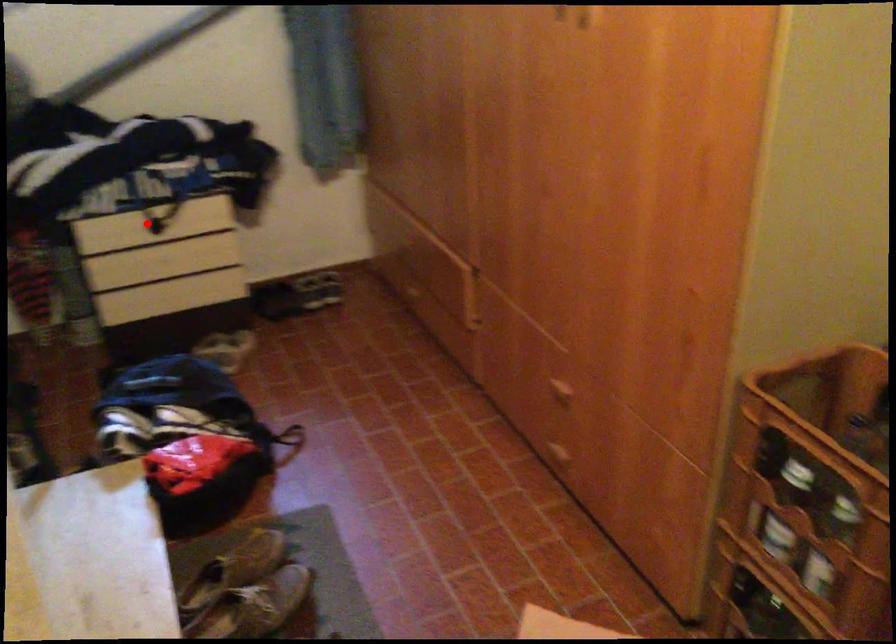
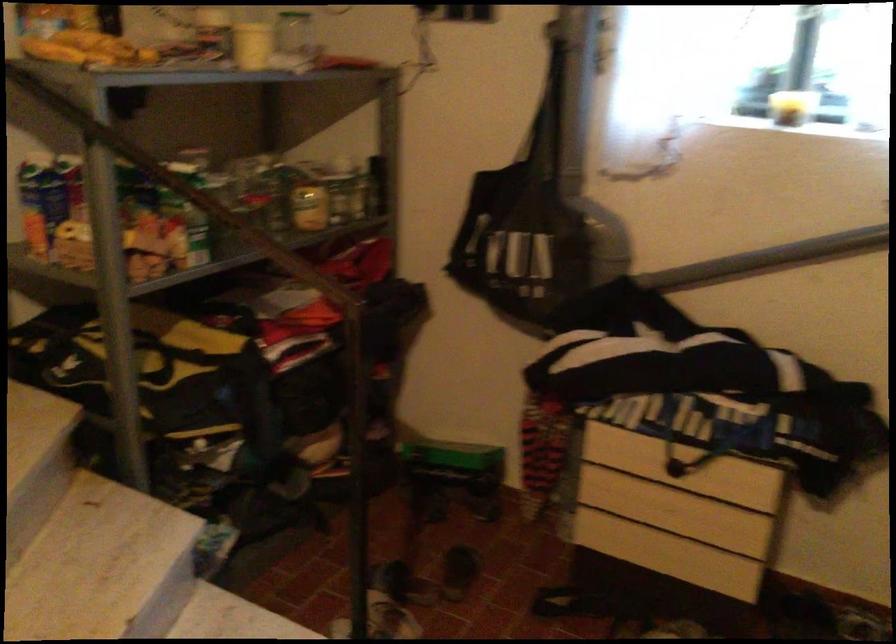
Question: I am providing you with two images of the same scene from different viewpoints. Image1 has a red point marked. In image2, the corresponding 3D location appears at what relative position? Reply with the corresponding letter.

Choices:
 (A) Closer
 (B) Farther

Answer: (A)